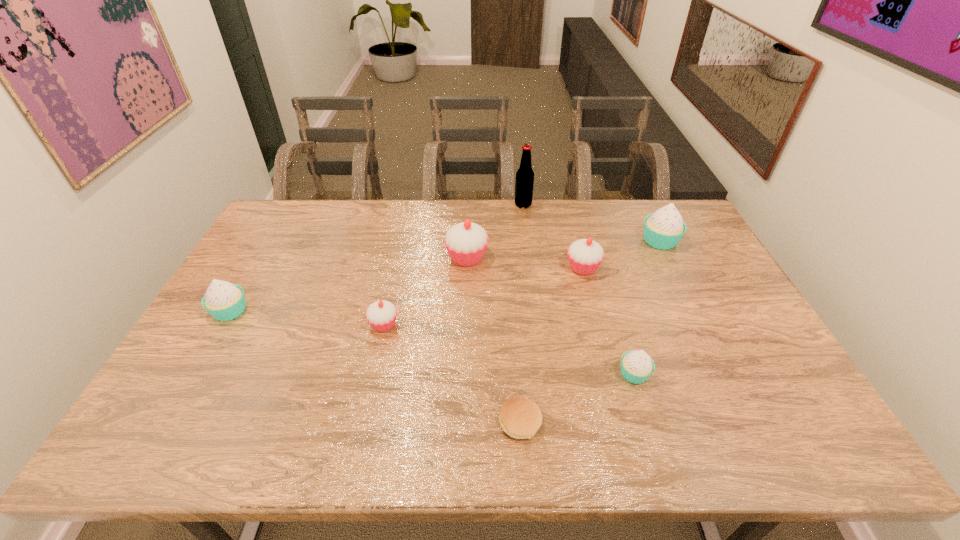
Choose which pink cupcake is the third nearest neighbor to the nearest cupcake. Please provide its 2D coordinates. Your answer should be formatted as a tuple, i.e. [(x, y)], where the tuple contains the x and y coordinates of a point satisfying the conditions above.

[(381, 315)]

Locate an element on the screen. This screenshot has width=960, height=540. white cupcake identified as the second closest to the nearest cupcake is located at coordinates (224, 301).

Select which white cupcake is the third closest to the second object from left to right. Please provide its 2D coordinates. Your answer should be formatted as a tuple, i.e. [(x, y)], where the tuple contains the x and y coordinates of a point satisfying the conditions above.

[(663, 229)]

Identify the location of vacant space that satisfies the following two spatial constraints: 1. on the back side of the second biggest white cupcake; 2. on the left side of the tallest object. (292, 205).

Identify the location of free spot that satisfies the following two spatial constraints: 1. on the front side of the patty; 2. on the right side of the leftmost object. This screenshot has height=540, width=960. (166, 422).

At what (x,y) coordinates should I click in order to perform the action: click on vacant position in the image that satisfies the following two spatial constraints: 1. on the front side of the smallest white cupcake; 2. on the right side of the biggest pink cupcake. Please return your answer as a coordinate pair (x, y). The width and height of the screenshot is (960, 540). Looking at the image, I should click on (463, 374).

Locate an element on the screen. free space that satisfies the following two spatial constraints: 1. on the front side of the second farthest white cupcake; 2. on the left side of the second object from left to right is located at coordinates (222, 325).

You are a GUI agent. You are given a task and a screenshot of the screen. Output one action in this format:
    pyautogui.click(x=<x>, y=<y>)
    Task: Click on the free space that satisfies the following two spatial constraints: 1. on the front side of the patty; 2. on the right side of the third object from left to right
    
    Given the screenshot: What is the action you would take?
    pyautogui.click(x=461, y=422)